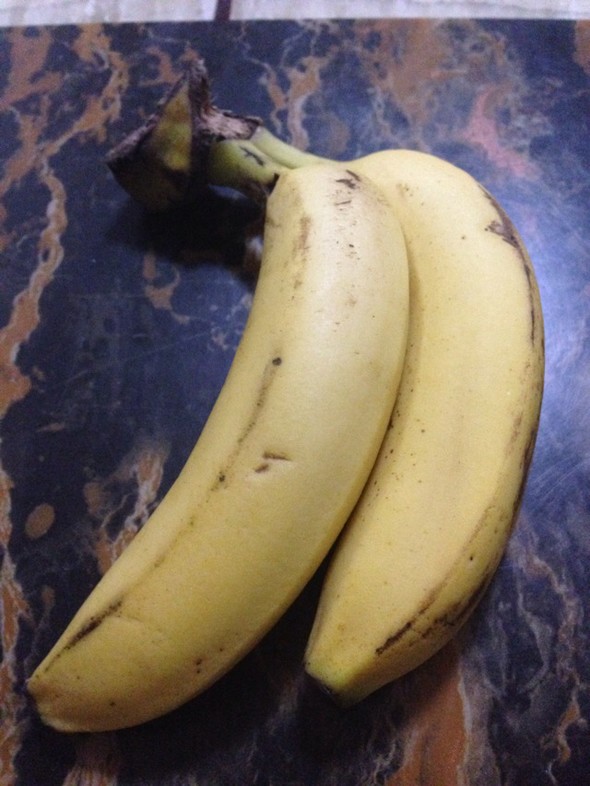
At what (x,y) coordinates should I click in order to perform the action: click on light grey floor in background. Please return your answer as a coordinate pair (x, y). Image resolution: width=590 pixels, height=786 pixels. Looking at the image, I should click on (91, 8), (401, 12).